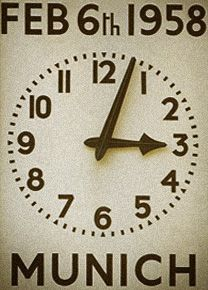
You are a GUI agent. You are given a task and a screenshot of the screen. Output one action in this format:
    pyautogui.click(x=<x>, y=<y>)
    Task: Click on the clock minute hand
    The image size is (208, 290).
    Given the screenshot: What is the action you would take?
    pyautogui.click(x=103, y=145), pyautogui.click(x=125, y=76)